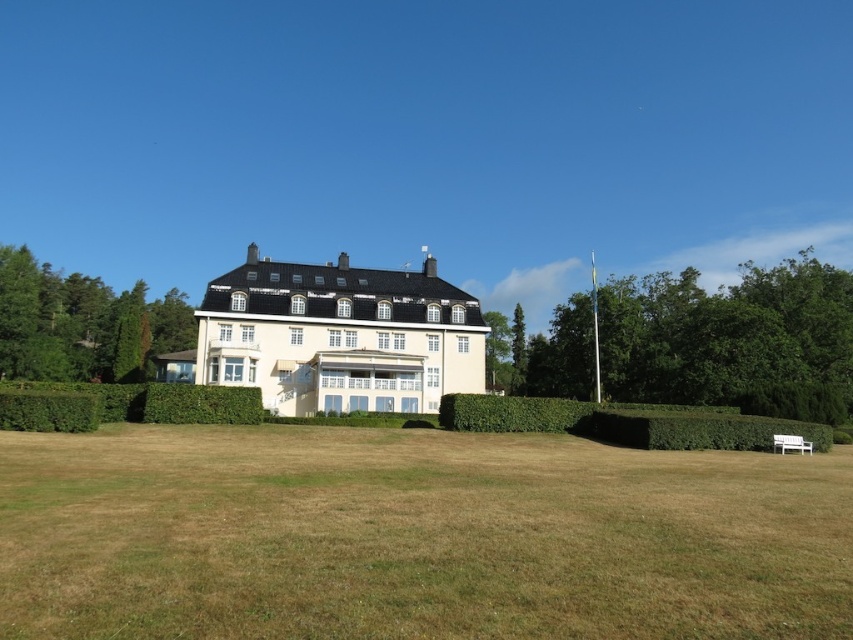
Where is `green leafy tree at right`? Image resolution: width=853 pixels, height=640 pixels. green leafy tree at right is located at coordinates (732, 339).

Which is behind, point (679, 317) or point (24, 304)?

Positioned behind is point (24, 304).

I want to click on green leafy tree at right, so click(732, 339).

In the scene shown: Between brown grass at center and green leafy tree at left, which one appears on the left side from the viewer's perspective?

green leafy tree at left

Is point (285, 497) more distant than point (68, 307)?

No, (285, 497) is in front of (68, 307).

The height and width of the screenshot is (640, 853). In order to click on brown grass at center in this screenshot , I will do `click(415, 536)`.

Is brown grass at center below green leafy tree at right?

Correct, brown grass at center is located below green leafy tree at right.

Which is behind, point (59, 474) or point (639, 358)?

The point (639, 358) is behind.

In order to click on brown grass at center in this screenshot , I will do `click(415, 536)`.